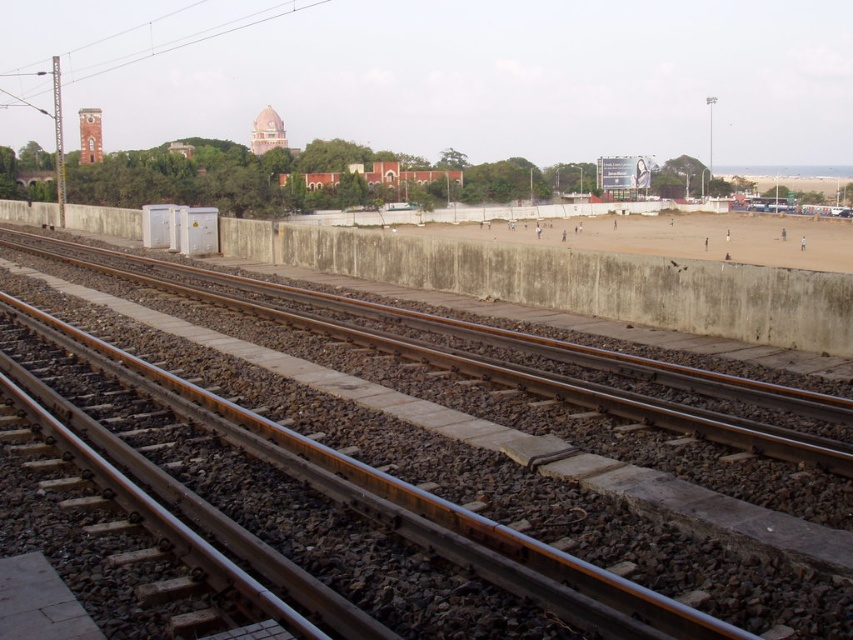
Between metal at left and brown sandy beach at center, which one appears on the left side from the viewer's perspective?

metal at left is more to the left.

Which of these two, metal at left or brown sandy beach at center, stands shorter?

With less height is metal at left.

Locate an element on the screen. metal at left is located at coordinates (433, 497).